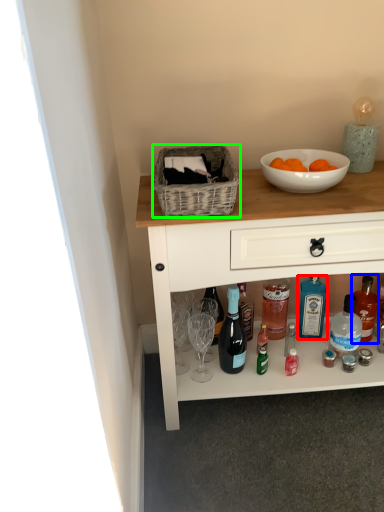
Question: Based on their relative distances, which object is nearer to bottle (highlighted by a red box)? Choose from bottle (highlighted by a blue box) and picnic basket (highlighted by a green box).

Choices:
 (A) bottle
 (B) picnic basket

Answer: (A)